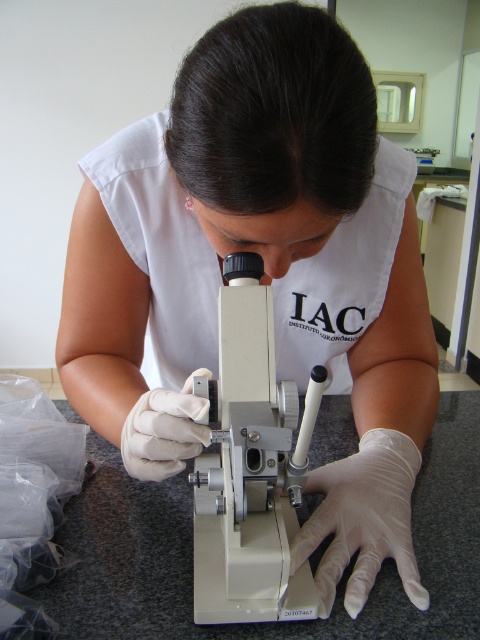
Does white plastic microscope at center appear over white smooth glove at center?

Actually, white plastic microscope at center is below white smooth glove at center.

Is point (214, 513) positioned in front of point (192, 442)?

No, (214, 513) is behind (192, 442).

Where is `white plastic microscope at center`? This screenshot has height=640, width=480. white plastic microscope at center is located at coordinates point(251,467).

Which is above, white plastic microscope at center or white latex glove at center?

white plastic microscope at center is higher up.

Is the position of white plastic microscope at center more distant than that of white latex glove at center?

No, white plastic microscope at center is in front of white latex glove at center.

Does point (311, 394) lie in front of point (340, 556)?

Yes, it is.

Find the location of a particular element. The height and width of the screenshot is (640, 480). white plastic microscope at center is located at coordinates (251, 467).

Does white latex glove at center have a greater height compared to white smooth glove at center?

Yes, white latex glove at center is taller than white smooth glove at center.

Does white latex glove at center have a smaller size compared to white smooth glove at center?

Actually, white latex glove at center might be larger than white smooth glove at center.

The image size is (480, 640). Identify the location of white latex glove at center. (362, 518).

The height and width of the screenshot is (640, 480). Find the location of `white latex glove at center`. white latex glove at center is located at coordinates (362, 518).